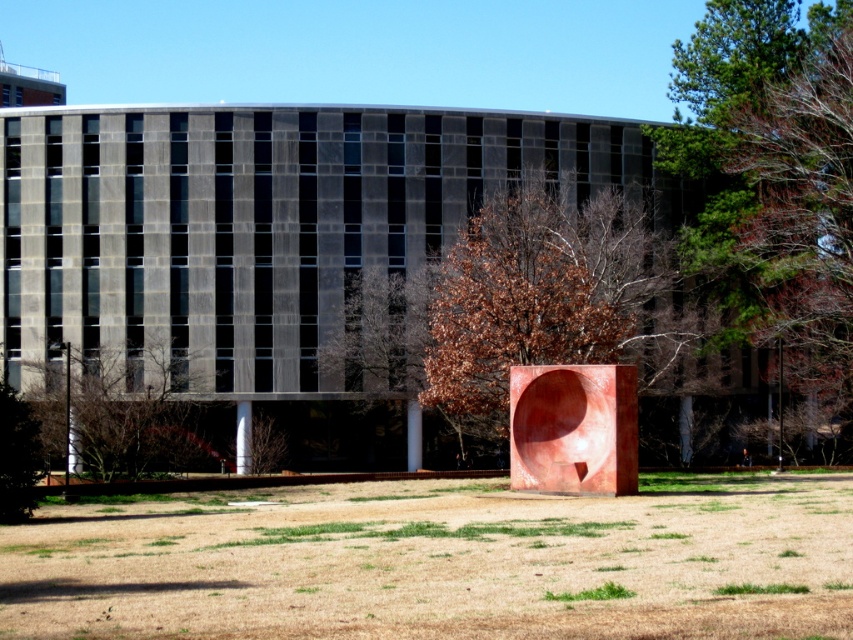
You are standing in front of the building and want to find a spot to place a picnic blanket. You see the brown leafy tree at upper right and the green grass at lower center. Which location would provide a shaded area for your picnic?

The brown leafy tree at upper right is positioned over green grass at lower center, so placing the picnic blanket under the brown leafy tree at upper right would provide shade from the tree.

Please provide the 2D coordinates of the brown leafy tree at upper right in the image. The coordinates should be in the format of a point with two decimal places, such as point 0.344, 0.943.

The brown leafy tree at upper right is located at point (804,220).

You are standing in front of the modern building and want to take a photo of both the brown matte tree at center and the brown leafy tree at lower left. Which tree should you position closer to the front of the photo to include both in the frame?

You should position the brown leafy tree at lower left closer to the front of the photo because it is located below the brown matte tree at center, allowing both to be captured in the frame.